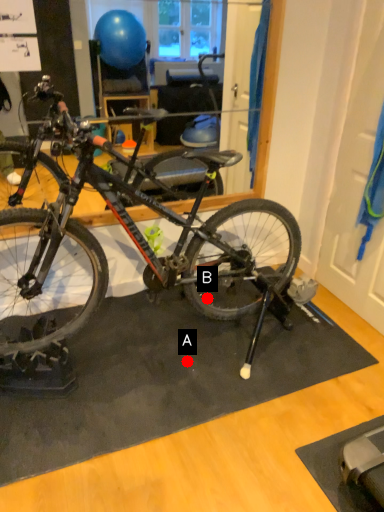
Question: Two points are circled on the image, labeled by A and B beside each circle. Which point appears closest to the camera in this image?

Choices:
 (A) A is closer
 (B) B is closer

Answer: (A)